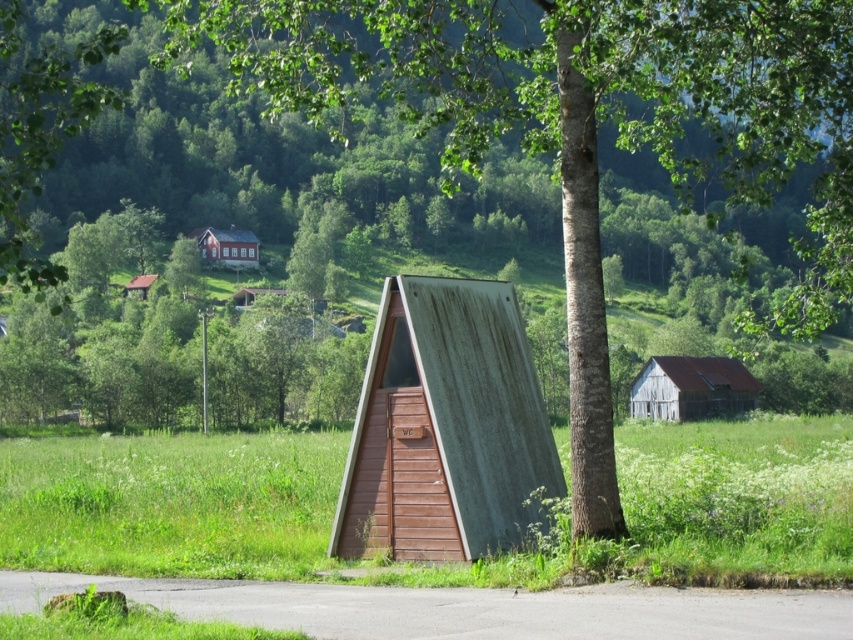
Which is more to the right, rusty metal shed at center or rusty corrugated metal hut at center?

From the viewer's perspective, rusty corrugated metal hut at center appears more on the right side.

Which of these two, rusty metal shed at center or rusty corrugated metal hut at center, stands taller?

rusty corrugated metal hut at center

What do you see at coordinates (445, 426) in the screenshot? The height and width of the screenshot is (640, 853). I see `rusty metal shed at center` at bounding box center [445, 426].

The height and width of the screenshot is (640, 853). What are the coordinates of `rusty metal shed at center` in the screenshot? It's located at (445, 426).

Which is more to the right, green grass at lower center or rusty metal shed at center?

From the viewer's perspective, rusty metal shed at center appears more on the right side.

Is green grass at lower center taller than rusty metal shed at center?

Yes.

Identify the location of green grass at lower center. (170, 502).

Between green rough bark tree at center and rusty corrugated metal hut at center, which one has more height?

With more height is green rough bark tree at center.

Between green rough bark tree at center and rusty corrugated metal hut at center, which one appears on the left side from the viewer's perspective?

green rough bark tree at center

Who is more forward, (595, 429) or (721, 390)?

Point (595, 429)

This screenshot has height=640, width=853. Identify the location of green rough bark tree at center. (581, 125).